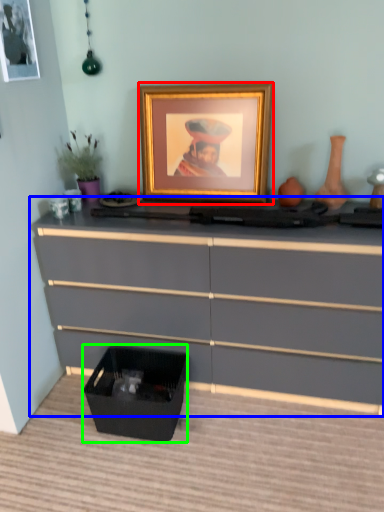
Question: Considering the real-world distances, which object is farthest from picture frame (highlighted by a red box)? chest of drawers (highlighted by a blue box) or storage box (highlighted by a green box)?

Choices:
 (A) chest of drawers
 (B) storage box

Answer: (B)